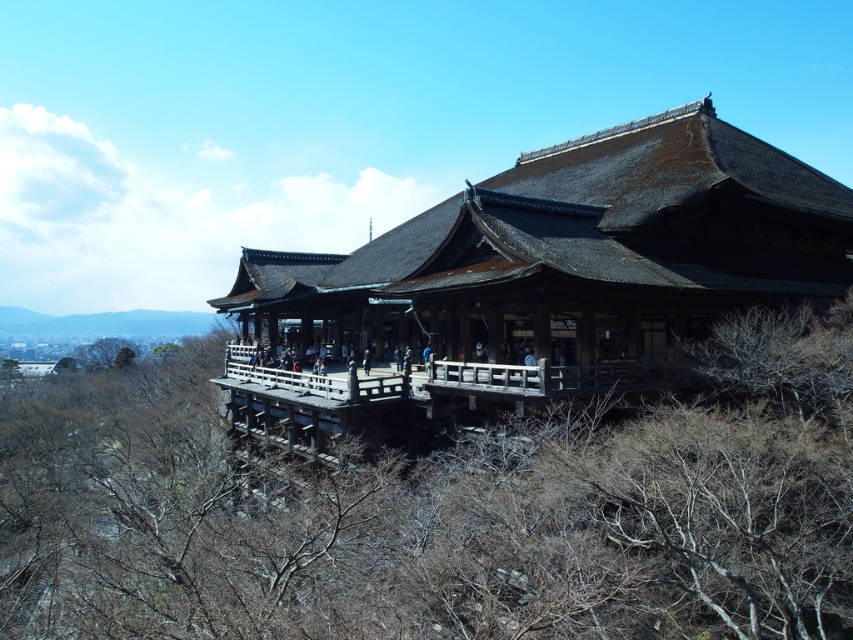
Question: Which of the following is the farthest from the observer?

Choices:
 (A) brown leafless branches at lower center
 (B) thatched wood temple at center

Answer: (B)

Question: Can you confirm if brown leafless branches at lower center is thinner than thatched wood temple at center?

Choices:
 (A) yes
 (B) no

Answer: (B)

Question: Which point is farther from the camera taking this photo?

Choices:
 (A) (834, 636)
 (B) (456, 291)

Answer: (B)

Question: Is brown leafless branches at lower center smaller than thatched wood temple at center?

Choices:
 (A) no
 (B) yes

Answer: (A)

Question: Is brown leafless branches at lower center above thatched wood temple at center?

Choices:
 (A) no
 (B) yes

Answer: (A)